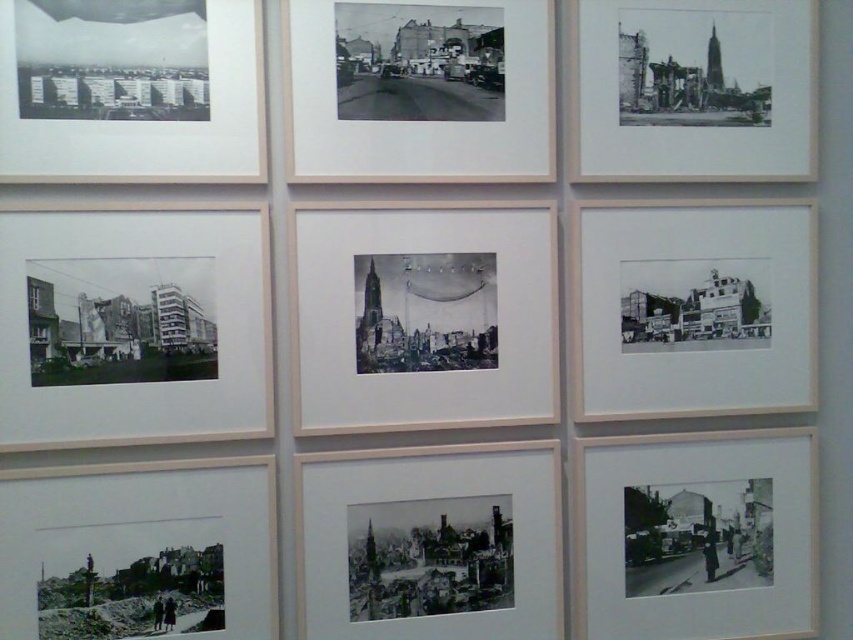
Question: Does black and white photograph of buildings at left have a smaller size compared to black paper at center?

Choices:
 (A) no
 (B) yes

Answer: (A)

Question: Can you confirm if black paper at center is bigger than smooth glossy photograph of cityscape at upper left?

Choices:
 (A) yes
 (B) no

Answer: (A)

Question: Among these points, which one is farthest from the camera?

Choices:
 (A) (328, 566)
 (B) (659, 605)
 (C) (234, 304)
 (D) (193, 502)

Answer: (B)

Question: Which of the following is the closest to the observer?

Choices:
 (A) (791, 547)
 (B) (532, 42)
 (C) (218, 20)
 (D) (410, 609)

Answer: (C)

Question: Is black and white photograph of buildings at left to the right of black paper photograph at lower left from the viewer's perspective?

Choices:
 (A) yes
 (B) no

Answer: (B)

Question: Which object appears farthest from the camera in this image?

Choices:
 (A) black paper at center
 (B) black and white photograph at upper right
 (C) black and white photograph at center

Answer: (B)